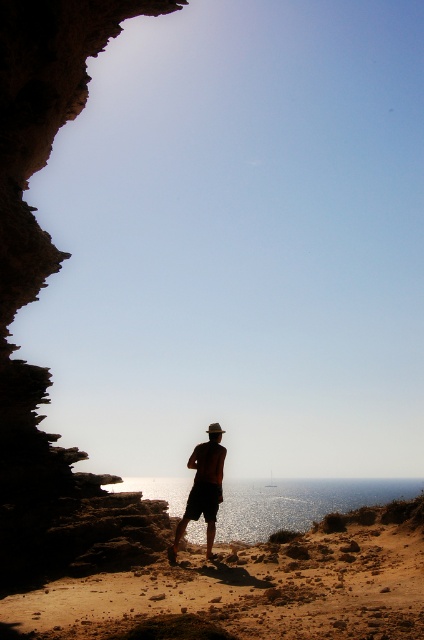
Question: Is brown sandy beach at lower center above dark brown rocky cliff at left?

Choices:
 (A) yes
 (B) no

Answer: (B)

Question: Is brown sandy beach at lower center smaller than silhouette hat at center?

Choices:
 (A) yes
 (B) no

Answer: (B)

Question: Which object is the farthest from the brown sandy beach at lower center?

Choices:
 (A) dark brown rocky cliff at left
 (B) silhouette hat at center

Answer: (A)

Question: Which object is closer to the camera taking this photo?

Choices:
 (A) silhouette hat at center
 (B) brown sandy beach at lower center
 (C) dark brown rocky cliff at left

Answer: (B)

Question: Based on their relative distances, which object is farther from the brown sandy beach at lower center?

Choices:
 (A) dark brown rocky cliff at left
 (B) silhouette hat at center

Answer: (A)

Question: Can you confirm if brown sandy beach at lower center is positioned to the left of silhouette hat at center?

Choices:
 (A) no
 (B) yes

Answer: (A)